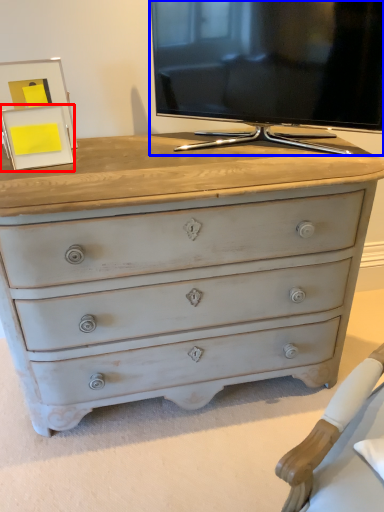
Question: Among these objects, which one is nearest to the camera, picture frame (highlighted by a red box) or television (highlighted by a blue box)?

Choices:
 (A) picture frame
 (B) television

Answer: (B)